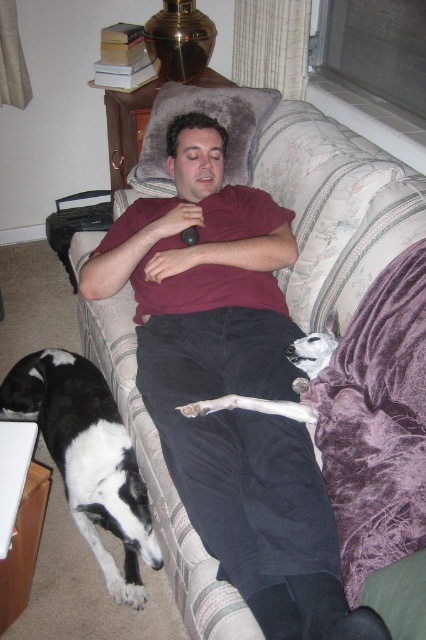
Is fuzzy gray pillow at upper center positioned before white fur dog at lower left?

No, fuzzy gray pillow at upper center is further to the viewer.

Which is below, fuzzy gray pillow at upper center or white fur dog at lower left?

white fur dog at lower left is below.

Measure the distance between fuzzy gray pillow at upper center and camera.

The distance of fuzzy gray pillow at upper center from camera is 7.04 feet.

I want to click on fuzzy gray pillow at upper center, so click(210, 116).

Between point (89, 401) and point (304, 344), which one is positioned behind?

The point (89, 401) is more distant.

Between point (63, 449) and point (291, 416), which one is positioned in front?

Positioned in front is point (291, 416).

Find the location of a particular element. Image resolution: width=426 pixels, height=640 pixels. black and white fur at lower left is located at coordinates (88, 458).

Is the position of black and white fur at lower left more distant than that of white fur dog at lower right?

Yes, it is behind white fur dog at lower right.

Who is higher up, black and white fur at lower left or white fur dog at lower right?

white fur dog at lower right is above.

Is point (83, 496) positioned in front of point (287, 346)?

No.

The height and width of the screenshot is (640, 426). Identify the location of black and white fur at lower left. (88, 458).